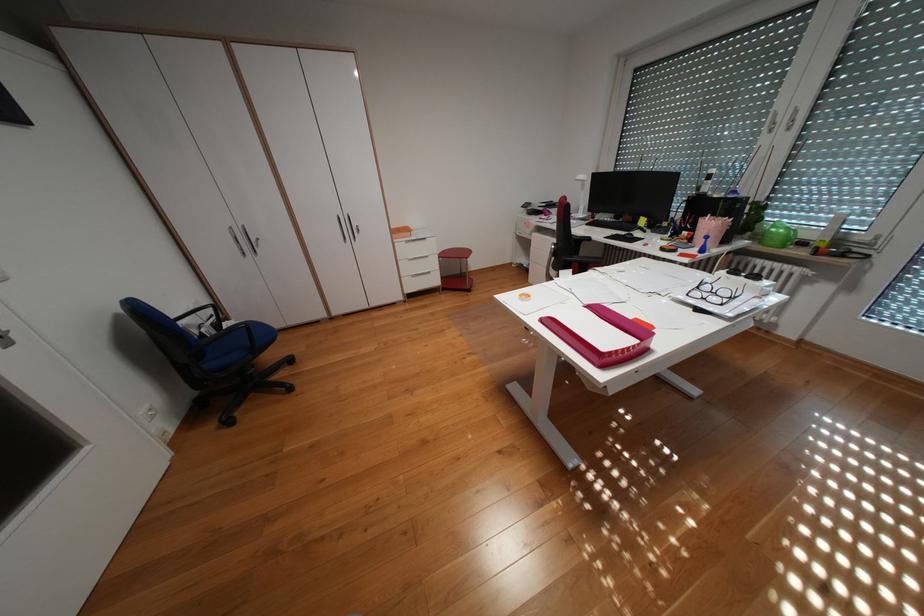
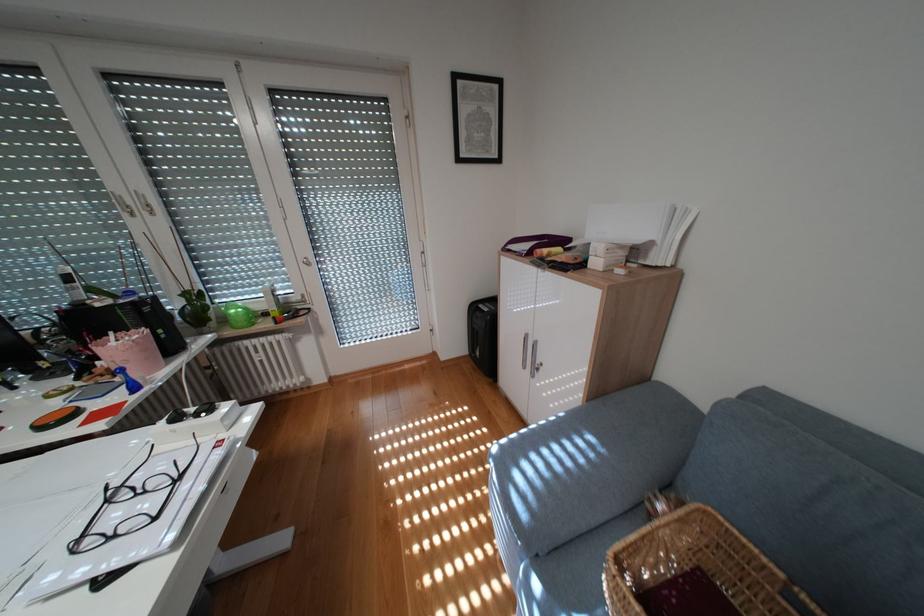
In the second image, find the point that corresponds to (x=785, y=225) in the first image.

(239, 308)